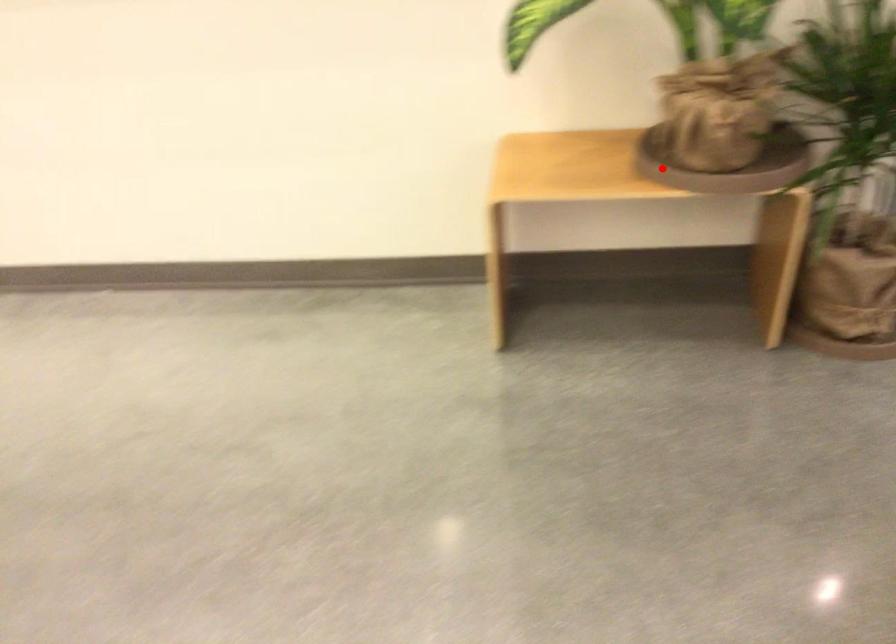
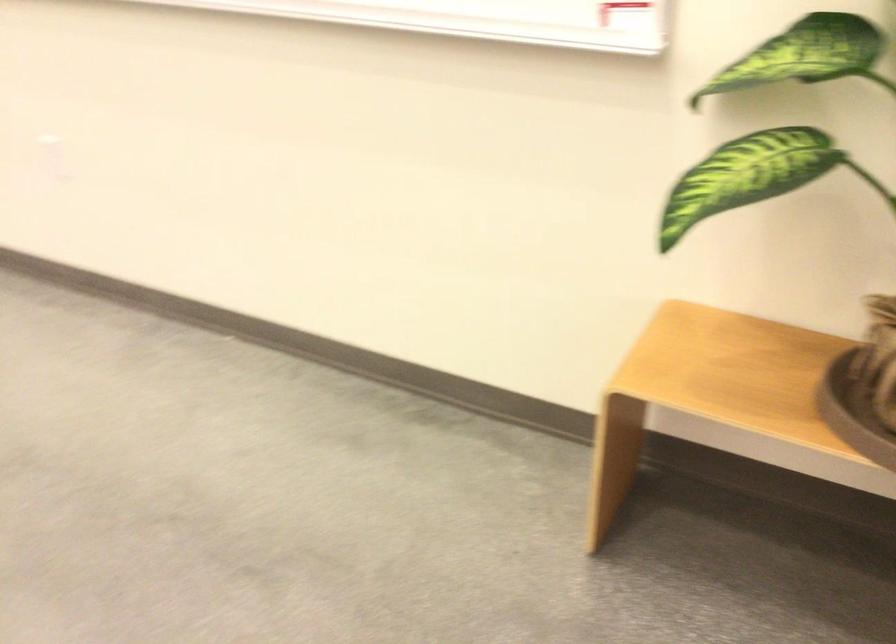
Locate, in the second image, the point that corresponds to the highlighted location in the first image.

(853, 413)